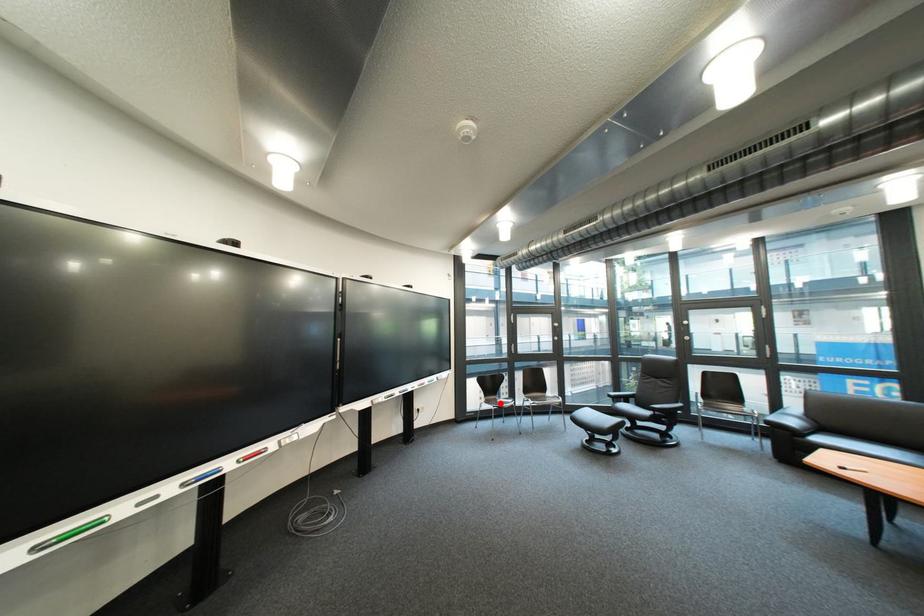
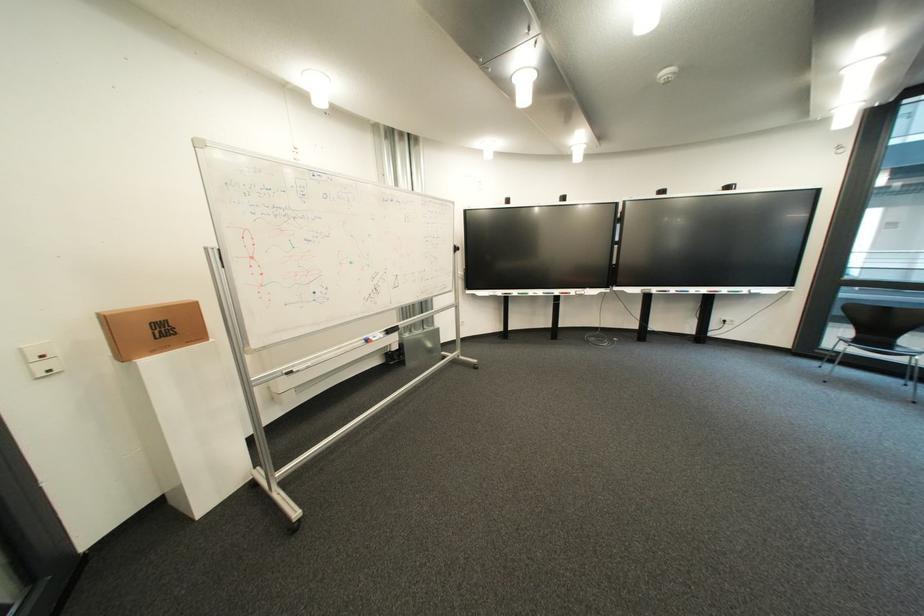
Find the pixel in the second image that matches the highlighted location in the first image.

(870, 342)